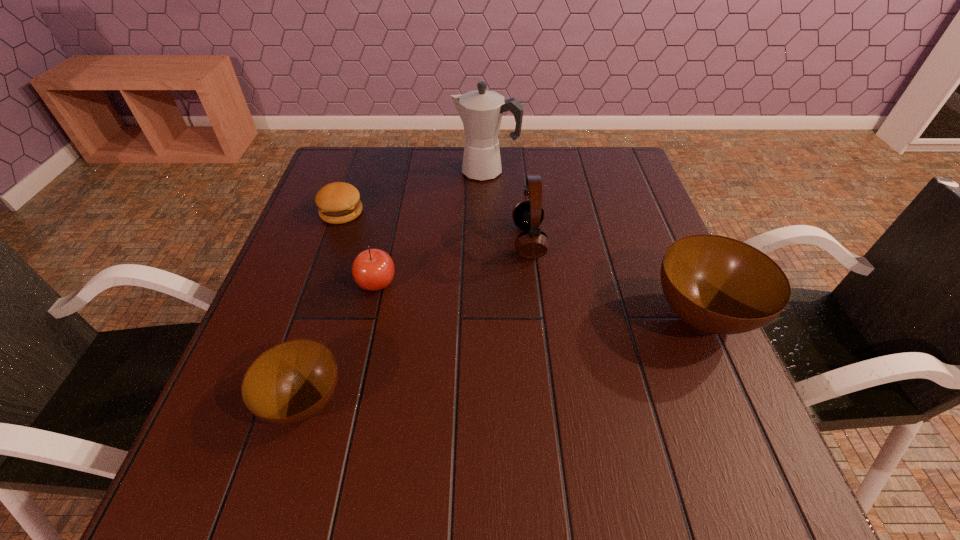
You are a GUI agent. You are given a task and a screenshot of the screen. Output one action in this format:
    pyautogui.click(x=<x>, y=<y>)
    Task: Click on the left bowl
    
    Given the screenshot: What is the action you would take?
    pyautogui.click(x=291, y=382)

At what (x,y) coordinates should I click in order to perform the action: click on the nearer bowl. Please return your answer as a coordinate pair (x, y). The height and width of the screenshot is (540, 960). Looking at the image, I should click on (291, 382).

I want to click on the farther bowl, so click(x=719, y=285).

At what (x,y) coordinates should I click in order to perform the action: click on the taller bowl. Please return your answer as a coordinate pair (x, y). Looking at the image, I should click on (719, 285).

Where is `the farthest object`? Image resolution: width=960 pixels, height=540 pixels. the farthest object is located at coordinates (481, 111).

Identify the location of coffeepot. (481, 111).

Identify the location of headset. The width and height of the screenshot is (960, 540). (528, 214).

You are a GUI agent. You are given a task and a screenshot of the screen. Output one action in this format:
    pyautogui.click(x=<x>, y=<y>)
    Task: Click on the apple
    The width and height of the screenshot is (960, 540).
    Given the screenshot: What is the action you would take?
    pyautogui.click(x=373, y=269)

Where is `hamburger`? hamburger is located at coordinates (338, 202).

The height and width of the screenshot is (540, 960). Identify the location of vacant region located on the right of the shorter bowl. (391, 402).